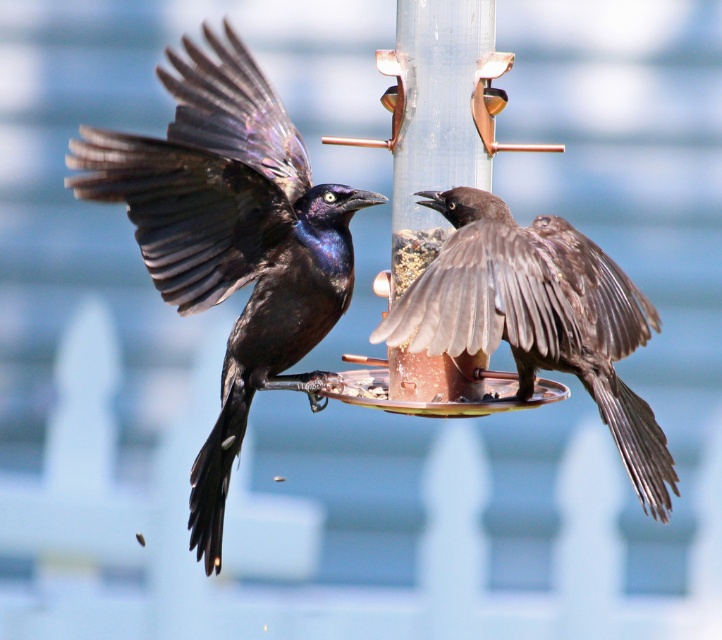
Does point (209, 125) come farther from viewer compared to point (422, 337)?

Yes, it is.

Can you confirm if shiny black bird at left is shorter than brown matte bird at center?

In fact, shiny black bird at left may be taller than brown matte bird at center.

Between point (347, 241) and point (445, 307), which one is positioned in front?

Point (445, 307) is in front.

At what (x,y) coordinates should I click in order to perform the action: click on shiny black bird at left. Please return your answer as a coordinate pair (x, y). Looking at the image, I should click on (230, 240).

Is point (443, 244) more distant than point (430, 234)?

Yes.

Who is lower down, brown matte bird at center or copper metallic pole at center?

brown matte bird at center is lower down.

Between point (430, 273) and point (388, 348), which one is positioned behind?

Point (388, 348)

This screenshot has height=640, width=722. In order to click on brown matte bird at center in this screenshot , I will do `click(539, 317)`.

What do you see at coordinates (230, 240) in the screenshot? I see `shiny black bird at left` at bounding box center [230, 240].

The height and width of the screenshot is (640, 722). What are the coordinates of `shiny black bird at left` in the screenshot? It's located at (230, 240).

The width and height of the screenshot is (722, 640). Identify the location of shiny black bird at left. (230, 240).